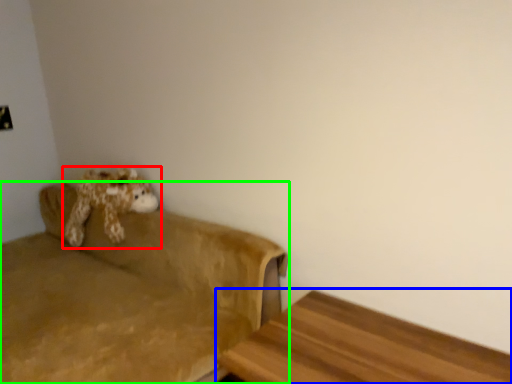
Question: Estimate the real-world distances between objects in this image. Which object is closer to toy (highlighted by a red box), furniture (highlighted by a blue box) or studio couch (highlighted by a green box)?

Choices:
 (A) furniture
 (B) studio couch

Answer: (B)